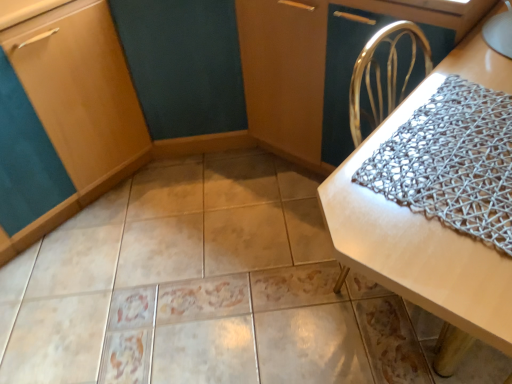
Question: Is beige glossy tile at center in front of white woven placemat at center?

Choices:
 (A) yes
 (B) no

Answer: (B)

Question: From a real-world perspective, is beige glossy tile at center positioned under white woven placemat at center based on gravity?

Choices:
 (A) no
 (B) yes

Answer: (B)

Question: Can white woven placemat at center be found inside beige glossy tile at center?

Choices:
 (A) yes
 (B) no

Answer: (B)

Question: Are beige glossy tile at center and white woven placemat at center located far from each other?

Choices:
 (A) yes
 (B) no

Answer: (B)

Question: Is beige glossy tile at center thinner than white woven placemat at center?

Choices:
 (A) no
 (B) yes

Answer: (A)

Question: Is silver mesh blanket at right bigger or smaller than beige glossy tile at center?

Choices:
 (A) small
 (B) big

Answer: (A)

Question: From a real-world perspective, is silver mesh blanket at right positioned above or below beige glossy tile at center?

Choices:
 (A) above
 (B) below

Answer: (A)

Question: From the image's perspective, relative to beige glossy tile at center, is silver mesh blanket at right above or below?

Choices:
 (A) above
 (B) below

Answer: (A)

Question: Relative to beige glossy tile at center, is silver mesh blanket at right in front or behind?

Choices:
 (A) front
 (B) behind

Answer: (A)

Question: Considering the positions of white woven placemat at center and matte wood cabinet at lower left in the image, is white woven placemat at center bigger or smaller than matte wood cabinet at lower left?

Choices:
 (A) small
 (B) big

Answer: (B)

Question: In the image, is white woven placemat at center on the left side or the right side of matte wood cabinet at lower left?

Choices:
 (A) left
 (B) right

Answer: (B)

Question: From the image's perspective, is white woven placemat at center positioned above or below matte wood cabinet at lower left?

Choices:
 (A) below
 (B) above

Answer: (A)

Question: Is point (343, 269) positioned closer to the camera than point (88, 132)?

Choices:
 (A) closer
 (B) farther

Answer: (A)

Question: In terms of size, does beige glossy tile at center appear bigger or smaller than matte wood cabinet at lower left?

Choices:
 (A) big
 (B) small

Answer: (B)

Question: Relative to matte wood cabinet at lower left, is beige glossy tile at center in front or behind?

Choices:
 (A) front
 (B) behind

Answer: (A)